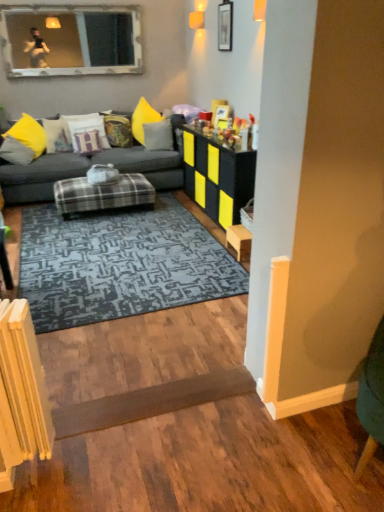
Question: Can dark gray fabric couch at center be found inside plaid fabric ottoman at center, the first table when ordered from left to right?

Choices:
 (A) no
 (B) yes

Answer: (A)

Question: From a real-world perspective, is plaid fabric ottoman at center, the first table when ordered from left to right, located higher than dark gray fabric couch at center?

Choices:
 (A) no
 (B) yes

Answer: (A)

Question: Is the position of plaid fabric ottoman at center, the first table when ordered from left to right, less distant than that of dark gray fabric couch at center?

Choices:
 (A) yes
 (B) no

Answer: (A)

Question: Is plaid fabric ottoman at center, which is the 2th table from right to left, not close to dark gray fabric couch at center?

Choices:
 (A) yes
 (B) no

Answer: (B)

Question: Is plaid fabric ottoman at center, which is the 2th table from right to left, in contact with dark gray fabric couch at center?

Choices:
 (A) no
 (B) yes

Answer: (A)

Question: Considering the relative sizes of plaid fabric ottoman at center, the first table when ordered from left to right, and dark gray fabric couch at center in the image provided, is plaid fabric ottoman at center, the first table when ordered from left to right, smaller than dark gray fabric couch at center?

Choices:
 (A) yes
 (B) no

Answer: (A)

Question: Is wooden picture frame at upper center at the left side of black textured cabinet at center, the second table in the left-to-right sequence?

Choices:
 (A) yes
 (B) no

Answer: (B)

Question: Considering the relative sizes of wooden picture frame at upper center and black textured cabinet at center, the 1th table in the right-to-left sequence, in the image provided, is wooden picture frame at upper center taller than black textured cabinet at center, the 1th table in the right-to-left sequence,?

Choices:
 (A) no
 (B) yes

Answer: (A)

Question: Is wooden picture frame at upper center next to black textured cabinet at center, the second table in the left-to-right sequence?

Choices:
 (A) no
 (B) yes

Answer: (A)

Question: Is black textured cabinet at center, the 1th table in the right-to-left sequence, inside wooden picture frame at upper center?

Choices:
 (A) no
 (B) yes

Answer: (A)

Question: Is wooden picture frame at upper center to the right of black textured cabinet at center, the 1th table in the right-to-left sequence, from the viewer's perspective?

Choices:
 (A) no
 (B) yes

Answer: (B)

Question: Is wooden picture frame at upper center oriented towards black textured cabinet at center, the 1th table in the right-to-left sequence?

Choices:
 (A) no
 (B) yes

Answer: (A)

Question: Does yellow fabric pillow at left, the 5th pillow from the right, have a larger size compared to blue textured rug at center?

Choices:
 (A) yes
 (B) no

Answer: (B)